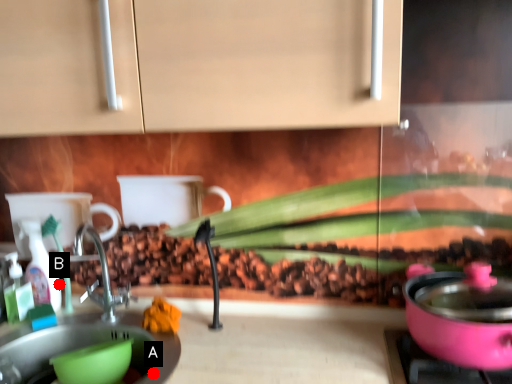
Question: Two points are circled on the image, labeled by A and B beside each circle. Which point is closer to the camera?

Choices:
 (A) A is closer
 (B) B is closer

Answer: (A)